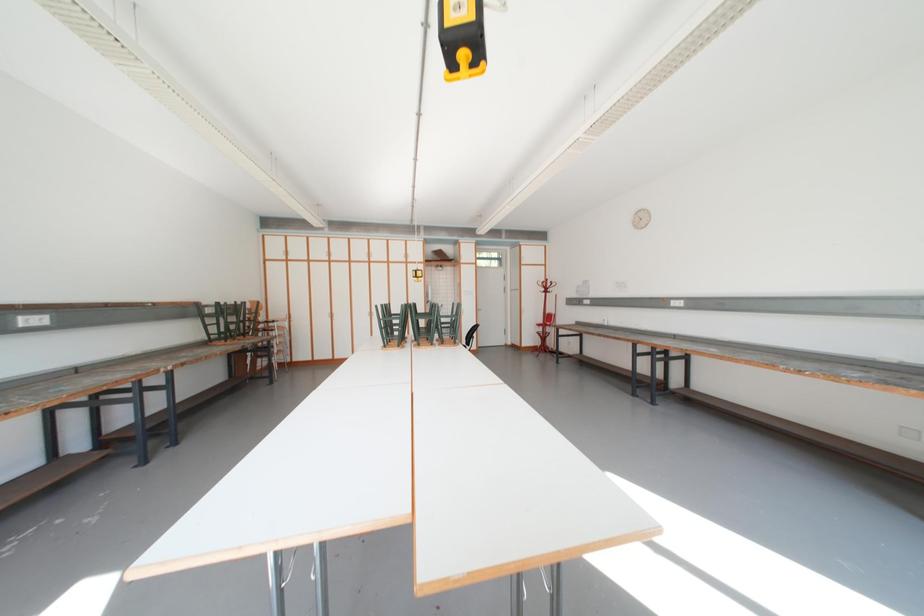
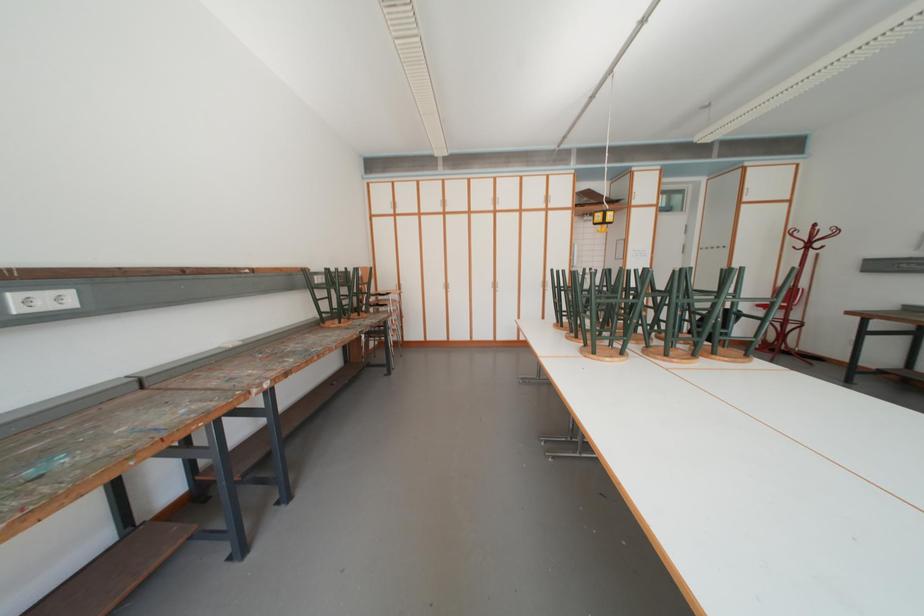
Which direction would the cameraman need to move to produce the second image?

The cameraman moved toward left, forward.